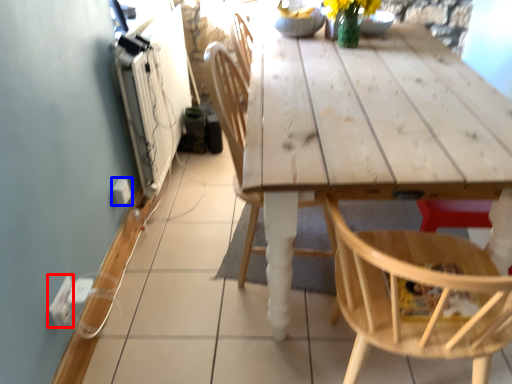
Question: Which of the following is the closest to the observer, electric outlet (highlighted by a red box) or electric outlet (highlighted by a blue box)?

Choices:
 (A) electric outlet
 (B) electric outlet

Answer: (A)